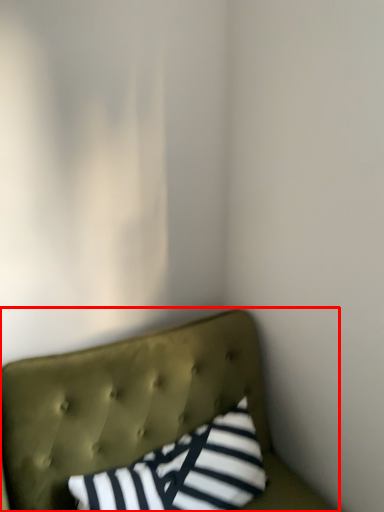
Question: From the image's perspective, where is furniture (annotated by the red box) located in relation to pillow in the image?

Choices:
 (A) below
 (B) above

Answer: (A)